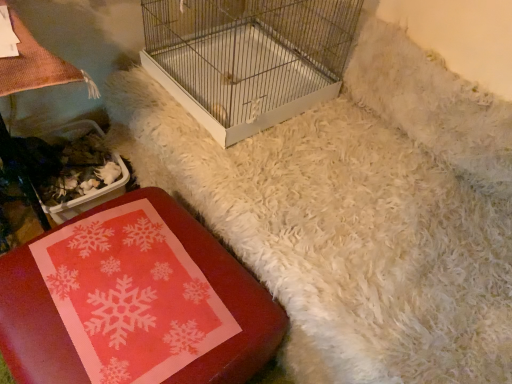
Question: Is matte red tray at lower left taller than white matte birdcage at center?

Choices:
 (A) no
 (B) yes

Answer: (A)

Question: From the image's perspective, would you say matte red tray at lower left is positioned over white matte birdcage at center?

Choices:
 (A) yes
 (B) no

Answer: (B)

Question: Considering the relative sizes of matte red tray at lower left and white matte birdcage at center in the image provided, is matte red tray at lower left bigger than white matte birdcage at center?

Choices:
 (A) no
 (B) yes

Answer: (B)

Question: Is the surface of matte red tray at lower left in direct contact with white matte birdcage at center?

Choices:
 (A) no
 (B) yes

Answer: (A)

Question: From the image's perspective, is matte red tray at lower left located beneath white matte birdcage at center?

Choices:
 (A) yes
 (B) no

Answer: (A)

Question: Does matte red tray at lower left have a lesser height compared to white matte birdcage at center?

Choices:
 (A) yes
 (B) no

Answer: (A)

Question: Is the surface of white matte birdcage at center in direct contact with matte red tray at lower left?

Choices:
 (A) no
 (B) yes

Answer: (A)

Question: From the image's perspective, would you say white matte birdcage at center is positioned over matte red tray at lower left?

Choices:
 (A) yes
 (B) no

Answer: (A)

Question: Can you confirm if white matte birdcage at center is wider than matte red tray at lower left?

Choices:
 (A) no
 (B) yes

Answer: (B)

Question: Does white matte birdcage at center have a greater height compared to matte red tray at lower left?

Choices:
 (A) no
 (B) yes

Answer: (B)

Question: Considering the relative sizes of white matte birdcage at center and matte red tray at lower left in the image provided, is white matte birdcage at center smaller than matte red tray at lower left?

Choices:
 (A) no
 (B) yes

Answer: (B)

Question: Is white matte birdcage at center to the right of matte red tray at lower left from the viewer's perspective?

Choices:
 (A) no
 (B) yes

Answer: (B)

Question: In terms of height, does white matte birdcage at center look taller or shorter compared to matte red tray at lower left?

Choices:
 (A) short
 (B) tall

Answer: (B)